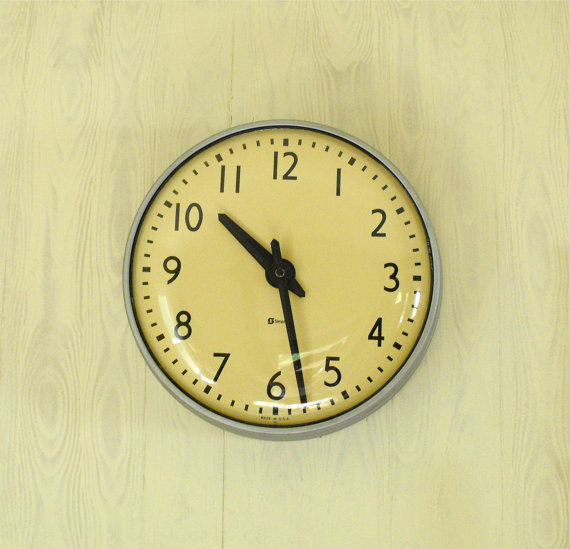
Locate an element on the screen. This screenshot has width=570, height=549. wooden wall is located at coordinates coord(48,290).